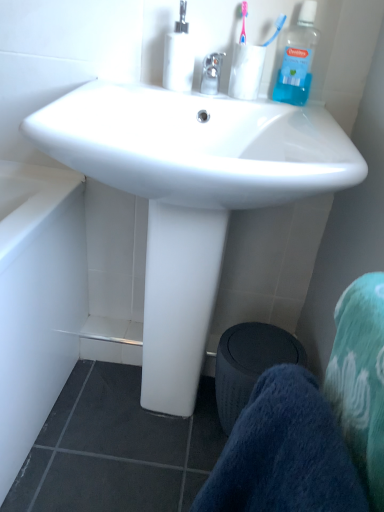
This screenshot has width=384, height=512. In order to click on empty space that is ontop of black fabric trash bin/can at lower center (from a real-world perspective) in this screenshot , I will do `click(257, 349)`.